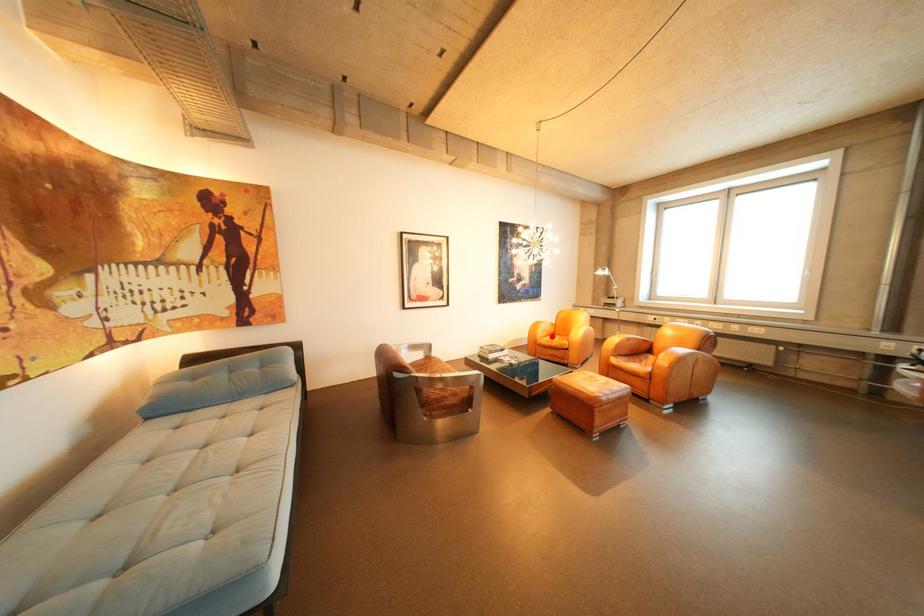
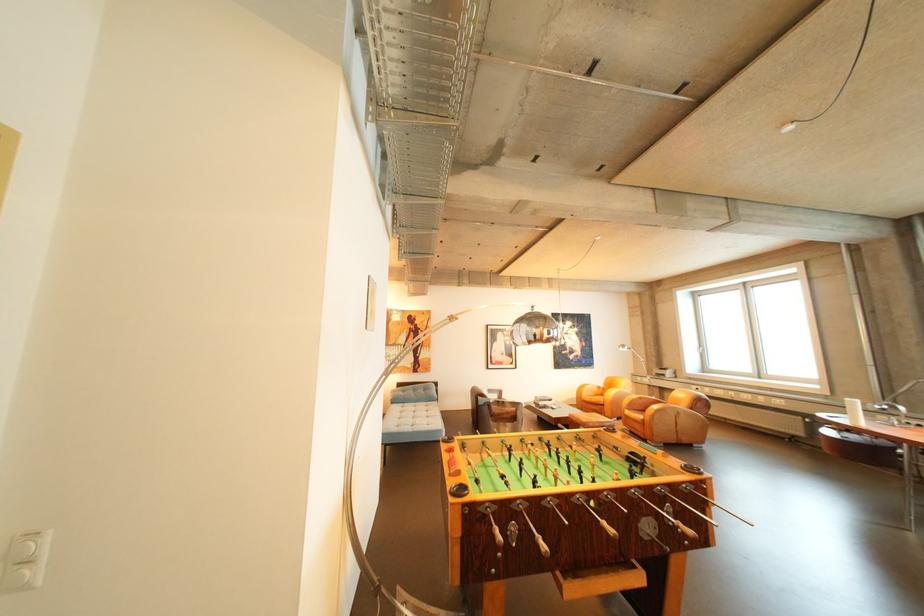
Question: I am providing you with two images of the same scene from different viewpoints. In image1, a red point is highlighted. Considering the same 3D point in image2, which of the following is correct?

Choices:
 (A) It is closer
 (B) It is farther

Answer: (B)